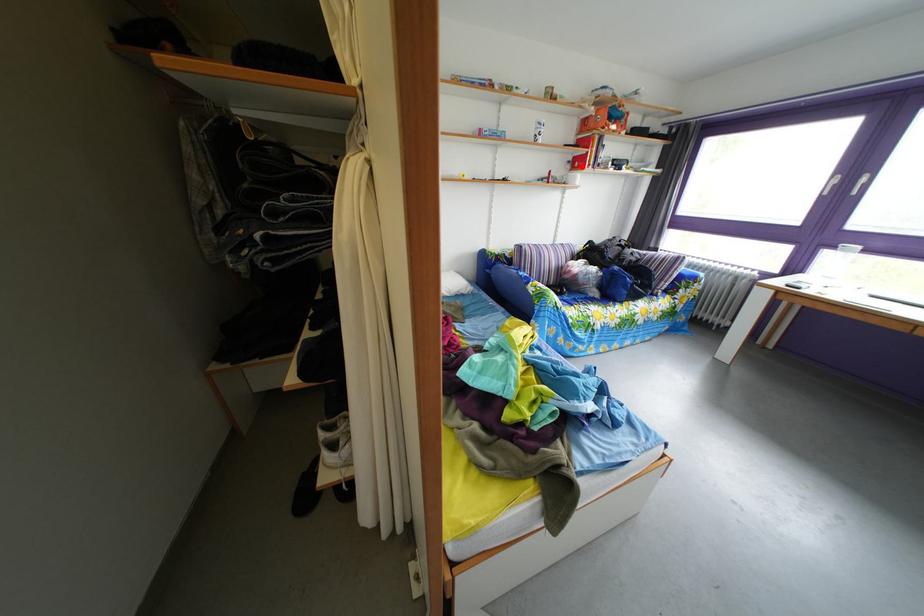
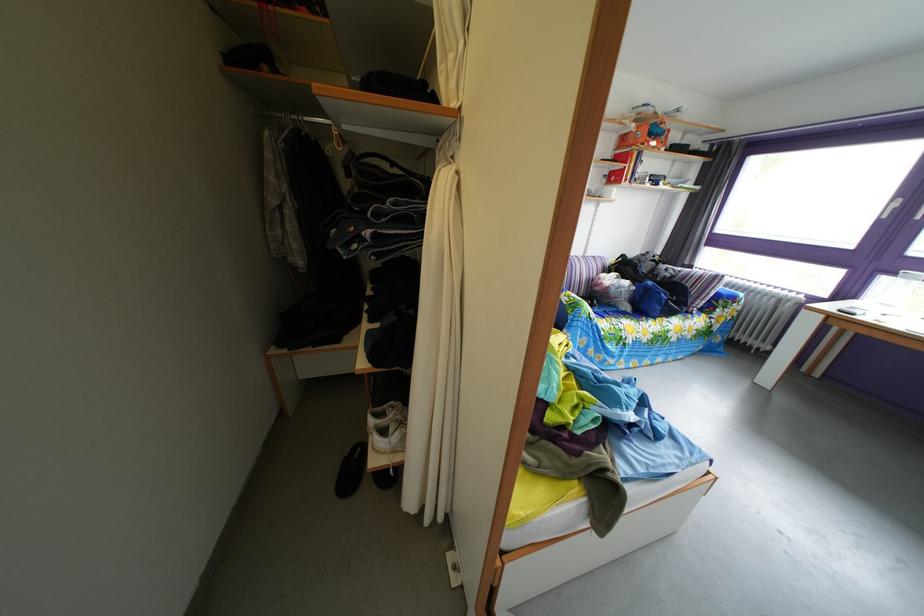
Where in the second image is the point corresponding to the highlighted location from the first image?

(618, 180)